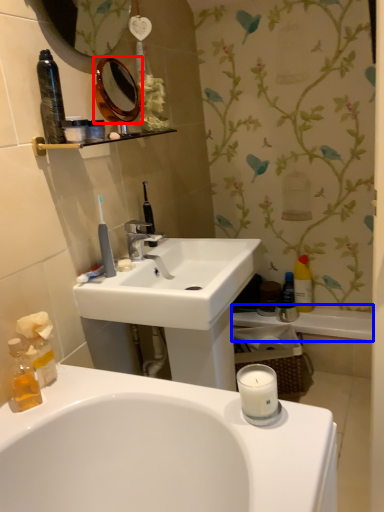
Question: Which object appears farthest to the camera in this image, mirror (highlighted by a red box) or bath (highlighted by a blue box)?

Choices:
 (A) mirror
 (B) bath

Answer: (B)